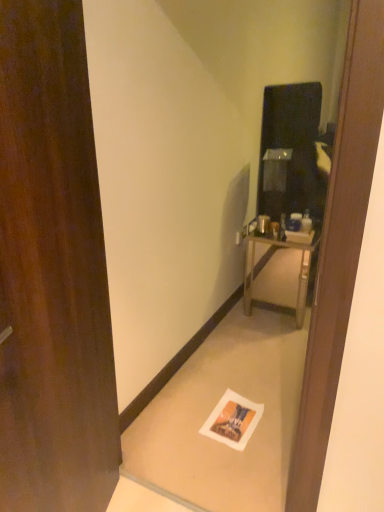
Identify the location of blank space above white paper at lower center (from a real-world perspective). (231, 421).